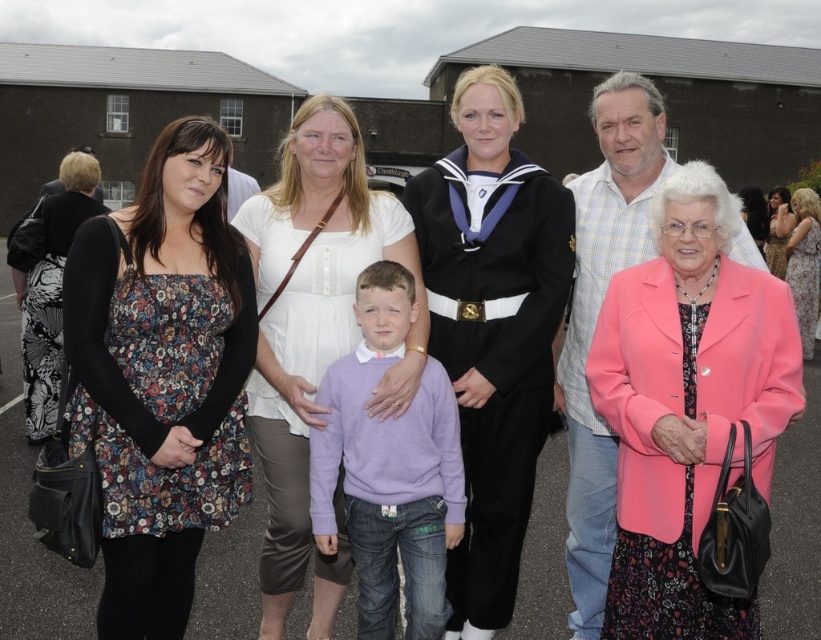
Does black and white floral dress at left come behind floral dress at right?

No, black and white floral dress at left is closer to the viewer.

Is black and white floral dress at left positioned in front of floral dress at right?

Yes, black and white floral dress at left is in front of floral dress at right.

Find the location of `black and white floral dress at left`. black and white floral dress at left is located at coordinates (48, 284).

Does floral dress at right have a lesser height compared to matte black dress at center?

Incorrect, floral dress at right's height does not fall short of matte black dress at center's.

Between point (803, 353) and point (766, 220), which one is positioned behind?

Positioned behind is point (766, 220).

Image resolution: width=821 pixels, height=640 pixels. Identify the location of floral dress at right. (805, 262).

At what (x,y) coordinates should I click in order to perform the action: click on lavender sweater at center. Please return your answer as a coordinate pair (x, y). Looking at the image, I should click on (388, 468).

Can you confirm if lavender sweater at center is bigger than matte black dress at center?

Indeed, lavender sweater at center has a larger size compared to matte black dress at center.

Is point (391, 284) positioned behind point (742, 212)?

No, it is in front of (742, 212).

At what (x,y) coordinates should I click in order to perform the action: click on lavender sweater at center. Please return your answer as a coordinate pair (x, y). The width and height of the screenshot is (821, 640). Looking at the image, I should click on (388, 468).